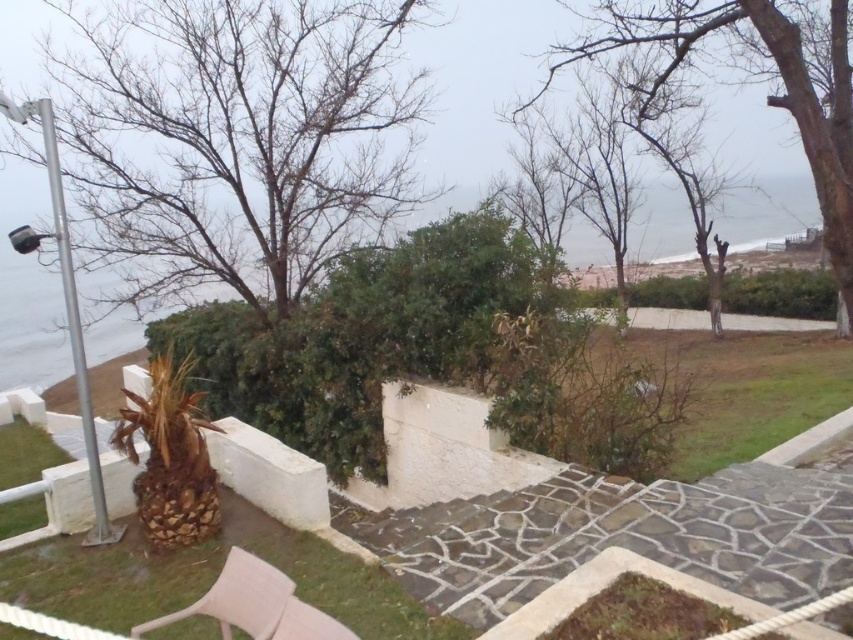
Which is below, bare wood tree at upper center or beige fabric chair at lower center?

beige fabric chair at lower center is below.

Can you confirm if bare wood tree at upper center is smaller than beige fabric chair at lower center?

No.

Describe the element at coordinates (766, 97) in the screenshot. I see `bare wood tree at upper center` at that location.

Find the location of a particular element. This screenshot has width=853, height=640. bare wood tree at upper center is located at coordinates (766, 97).

Is bare branches at upper left shorter than bare wood tree at upper center?

Correct, bare branches at upper left is not as tall as bare wood tree at upper center.

Which is in front, point (343, 4) or point (846, 176)?

Point (846, 176) is more forward.

Describe the element at coordinates (234, 140) in the screenshot. I see `bare branches at upper left` at that location.

Identify the location of bare branches at upper left. This screenshot has height=640, width=853. (234, 140).

Can you confirm if bare branches at upper left is taller than beige fabric chair at lower center?

Yes, bare branches at upper left is taller than beige fabric chair at lower center.

The height and width of the screenshot is (640, 853). What do you see at coordinates (234, 140) in the screenshot?
I see `bare branches at upper left` at bounding box center [234, 140].

The image size is (853, 640). What are the coordinates of `bare branches at upper left` in the screenshot? It's located at (234, 140).